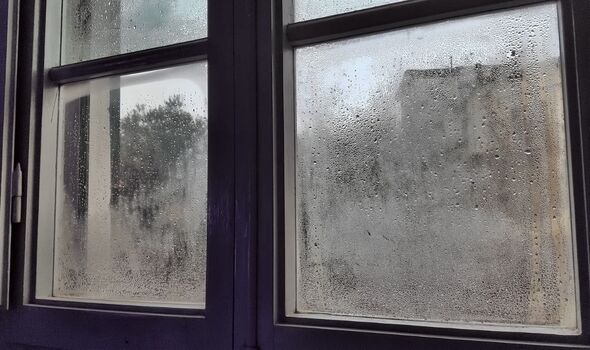
This screenshot has width=590, height=350. Identify the location of windows. (407, 120), (307, 7), (137, 11), (116, 181).